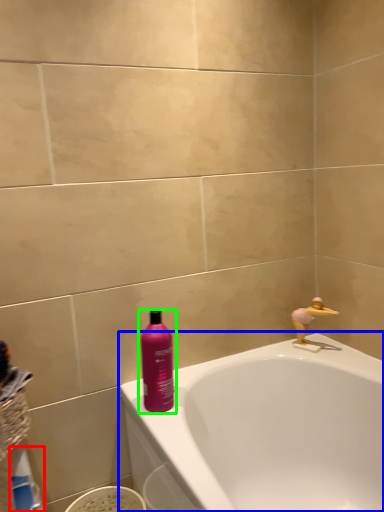
Question: Which object is the farthest from cleaning product (highlighted by a red box)? Choose among these: bathtub (highlighted by a blue box) or bottle (highlighted by a green box).

Choices:
 (A) bathtub
 (B) bottle

Answer: (A)